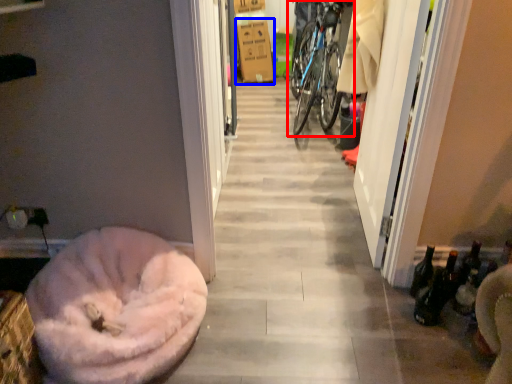
Question: Which object is closer to the camera taking this photo, bicycle (highlighted by a red box) or cardboard box (highlighted by a blue box)?

Choices:
 (A) bicycle
 (B) cardboard box

Answer: (A)